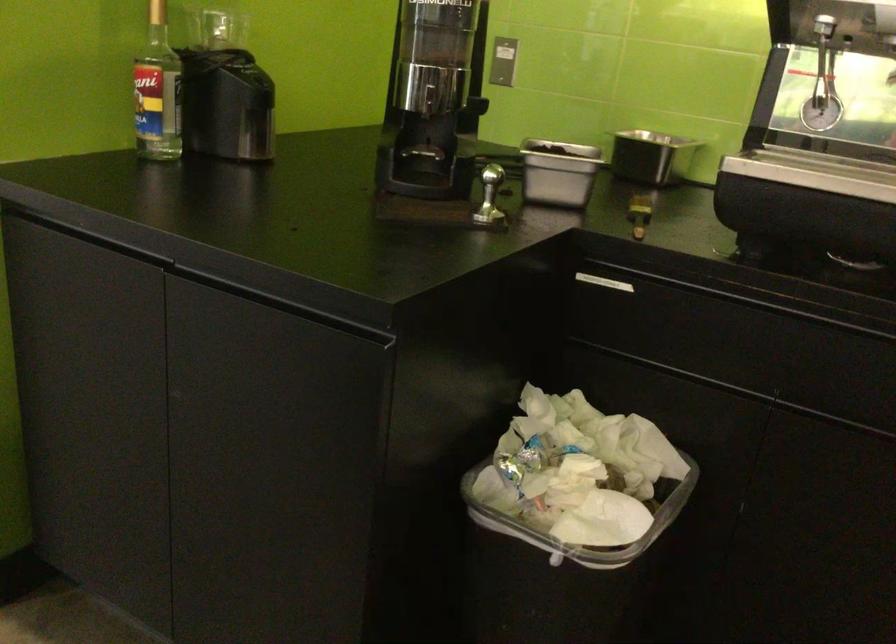
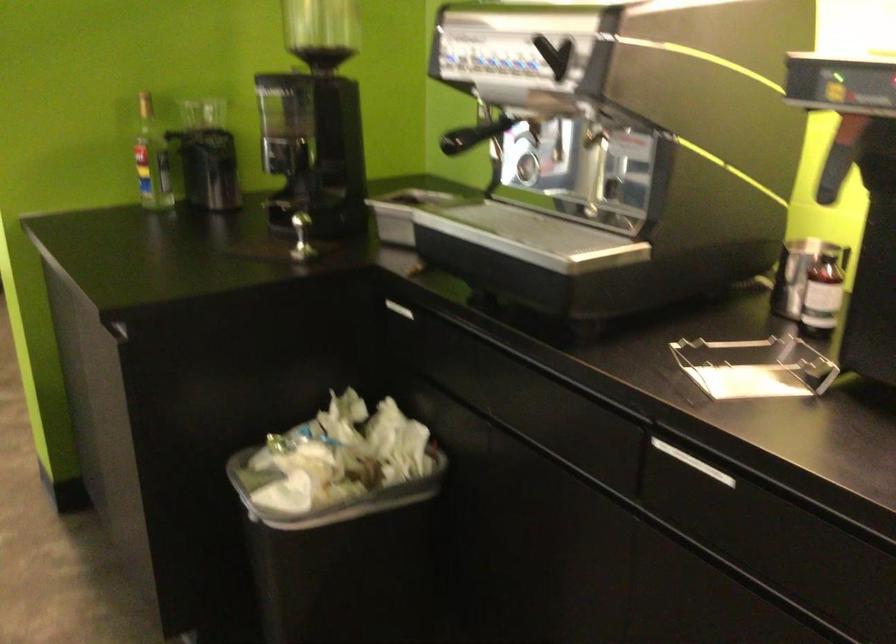
Locate, in the second image, the point that corresponds to (x=607, y=520) in the first image.

(328, 495)